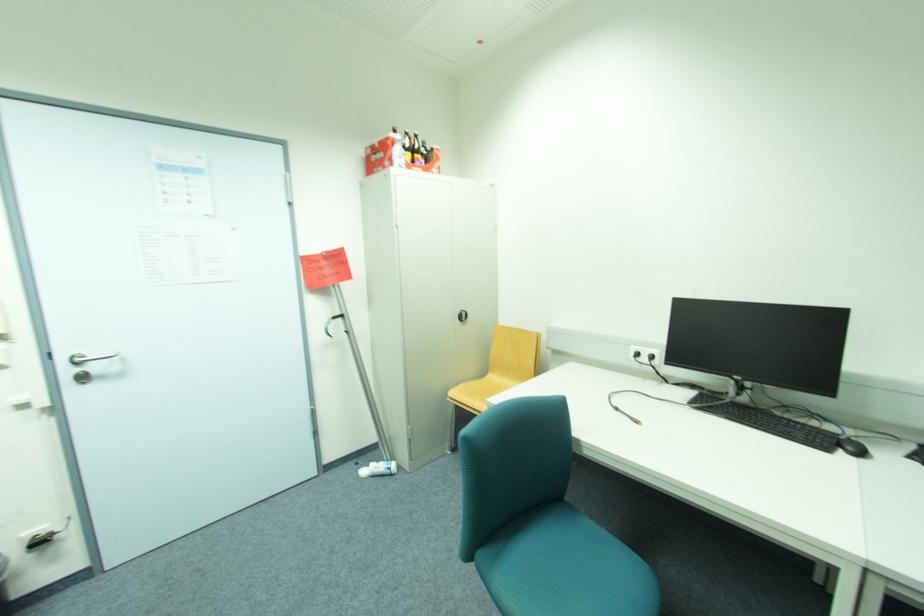
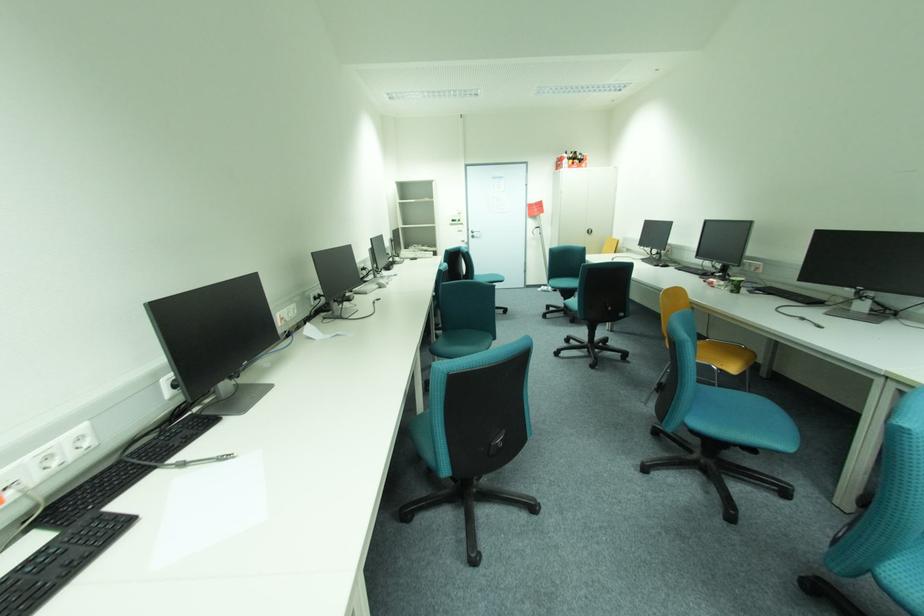
Locate, in the second image, the point that corresponds to (74,371) in the first image.

(477, 235)